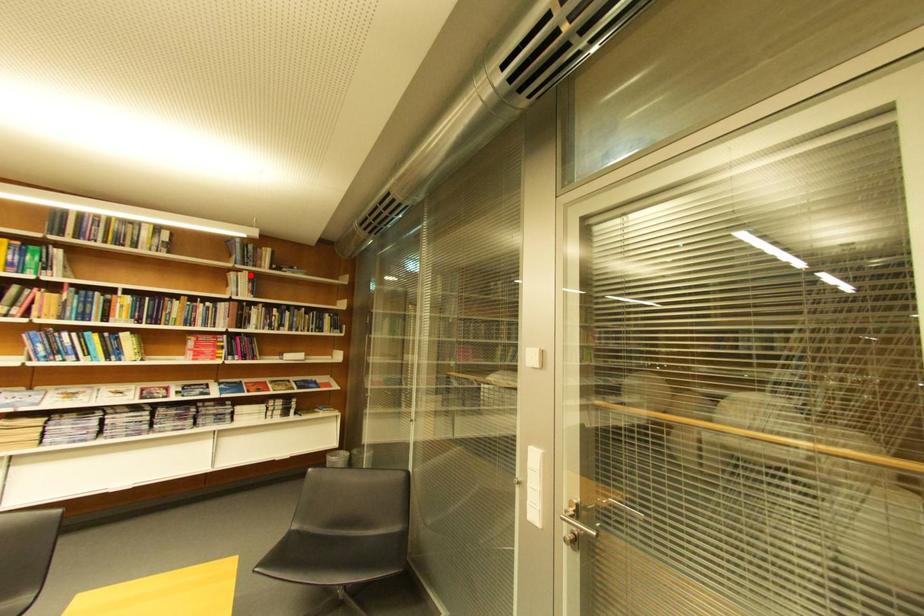
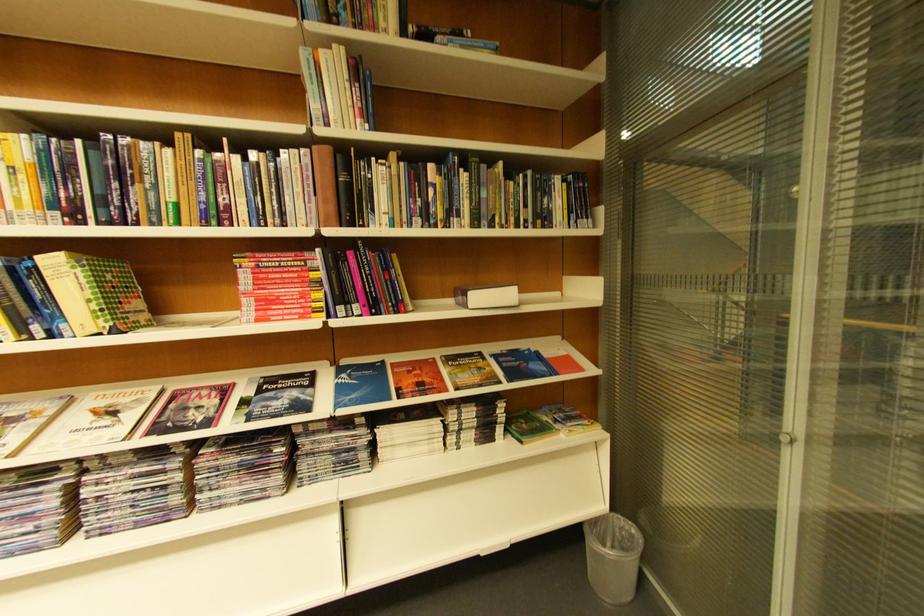
The point at the highlighted location is marked in the first image. Where is the corresponding point in the second image?

(332, 55)